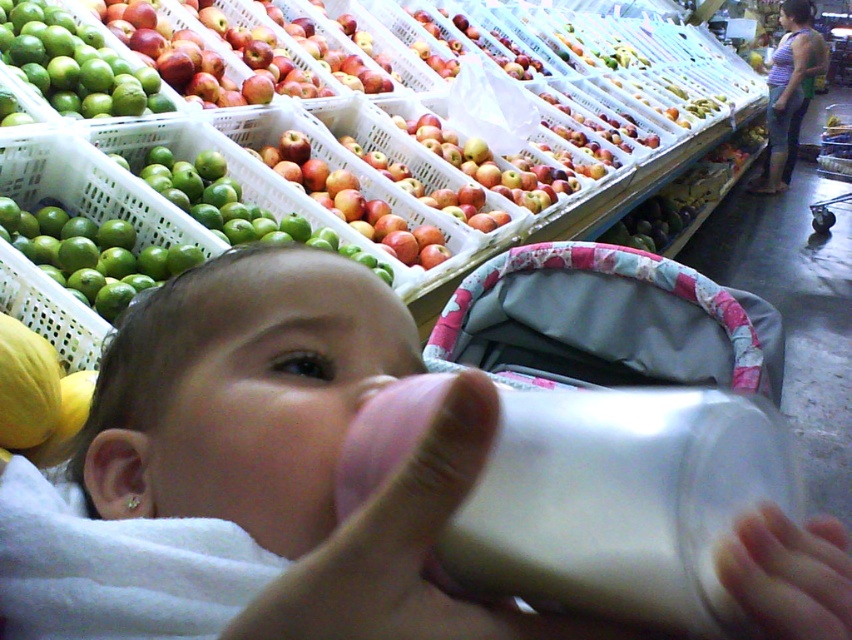
What do you see at coordinates (233, 204) in the screenshot? The image size is (852, 640). I see `green matte apples at upper left` at bounding box center [233, 204].

Which is in front, point (378, 264) or point (448, 145)?

Point (378, 264) is in front.

Measure the distance between point (258, 209) and camera.

1.71 meters

Where is `green matte apples at upper left`? The image size is (852, 640). green matte apples at upper left is located at coordinates (233, 204).

Does green matte limes at left have a lesser width compared to green matte apple at center?

Yes, green matte limes at left is thinner than green matte apple at center.

Between green matte limes at left and green matte apple at center, which one is positioned lower?

green matte apple at center

Locate an element on the screen. The width and height of the screenshot is (852, 640). green matte limes at left is located at coordinates (73, 64).

Does transparent plastic bottle at center have a lesser width compared to green matte apple at center?

Correct, transparent plastic bottle at center's width is less than green matte apple at center's.

Is transparent plastic bottle at center bigger than green matte apple at center?

No, transparent plastic bottle at center is not bigger than green matte apple at center.

Which is in front, point (521, 564) or point (355, 220)?

Point (521, 564)

Find the location of a particular element. Image resolution: width=852 pixels, height=640 pixels. transparent plastic bottle at center is located at coordinates [619, 502].